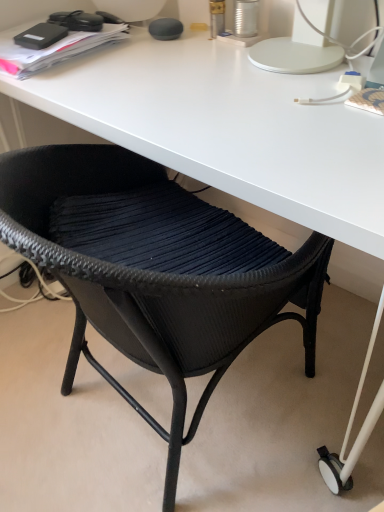
What do you see at coordinates (154, 270) in the screenshot? I see `black woven chair at lower center` at bounding box center [154, 270].

This screenshot has width=384, height=512. In order to click on black woven chair at lower center in this screenshot , I will do `click(154, 270)`.

What are the coordinates of `black woven chair at lower center` in the screenshot? It's located at (154, 270).